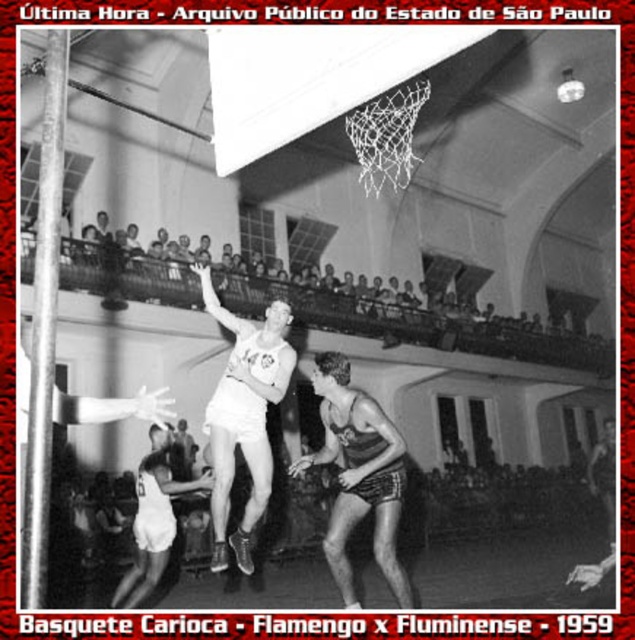
Does smooth leather shorts at center lie behind white matte basketball player at center?

No, it is not.

Between smooth leather shorts at center and white matte basketball player at center, which one is positioned lower?

Positioned lower is smooth leather shorts at center.

You are a GUI agent. You are given a task and a screenshot of the screen. Output one action in this format:
    pyautogui.click(x=<x>, y=<y>)
    Task: Click on the smooth leather shorts at center
    The height and width of the screenshot is (640, 635).
    Given the screenshot: What is the action you would take?
    pyautogui.click(x=358, y=476)

Who is more forward, (361, 426) or (184, 484)?

Positioned in front is point (361, 426).

Is smooth leather shorts at center bigger than white matte shorts at center?

No, smooth leather shorts at center is not bigger than white matte shorts at center.

The image size is (635, 640). In order to click on smooth leather shorts at center in this screenshot , I will do `click(358, 476)`.

Locate an element on the screen. The height and width of the screenshot is (640, 635). smooth leather shorts at center is located at coordinates coord(358,476).

Based on the photo, does white matte basketball player at center have a greater width compared to white matte shorts at center?

No.

In order to click on white matte basketball player at center in this screenshot , I will do `click(243, 416)`.